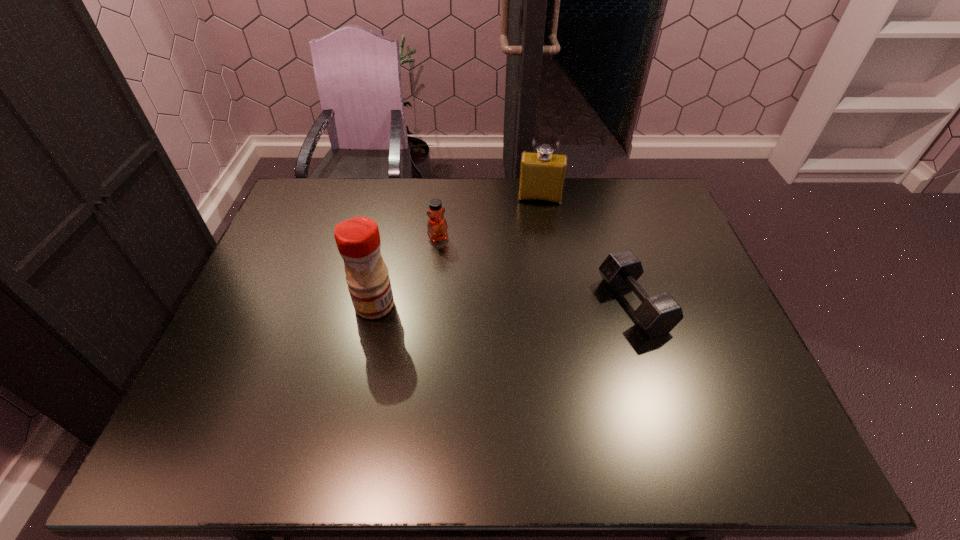
You are a GUI agent. You are given a task and a screenshot of the screen. Output one action in this format:
    pyautogui.click(x=<x>, y=<y>)
    Task: Click on the vacant region located on the front-facing side of the second tallest object
    The height and width of the screenshot is (540, 960).
    Given the screenshot: What is the action you would take?
    pyautogui.click(x=536, y=230)

The height and width of the screenshot is (540, 960). Identify the location of free region located on the front-facing side of the second tallest object. (533, 267).

The width and height of the screenshot is (960, 540). Identify the location of vacant space located 0.160m on the front-facing side of the second tallest object. (536, 236).

Where is `vacant space located 0.050m on the front label of the third nearest object`? The width and height of the screenshot is (960, 540). vacant space located 0.050m on the front label of the third nearest object is located at coordinates (445, 254).

Identify the location of vacant space located on the front label of the third nearest object. This screenshot has height=540, width=960. (460, 286).

I want to click on blank space located on the front label of the third nearest object, so click(464, 294).

You are a GUI agent. You are given a task and a screenshot of the screen. Output one action in this format:
    pyautogui.click(x=<x>, y=<y>)
    Task: Click on the object that is at the far edge
    This screenshot has width=960, height=540.
    Given the screenshot: What is the action you would take?
    pyautogui.click(x=542, y=174)

Where is `object positioned at the right edge`? This screenshot has height=540, width=960. object positioned at the right edge is located at coordinates (657, 315).

Where is `vacant space at the far edge`? vacant space at the far edge is located at coordinates (462, 193).

Image resolution: width=960 pixels, height=540 pixels. I want to click on vacant region at the near edge of the desktop, so click(x=461, y=384).